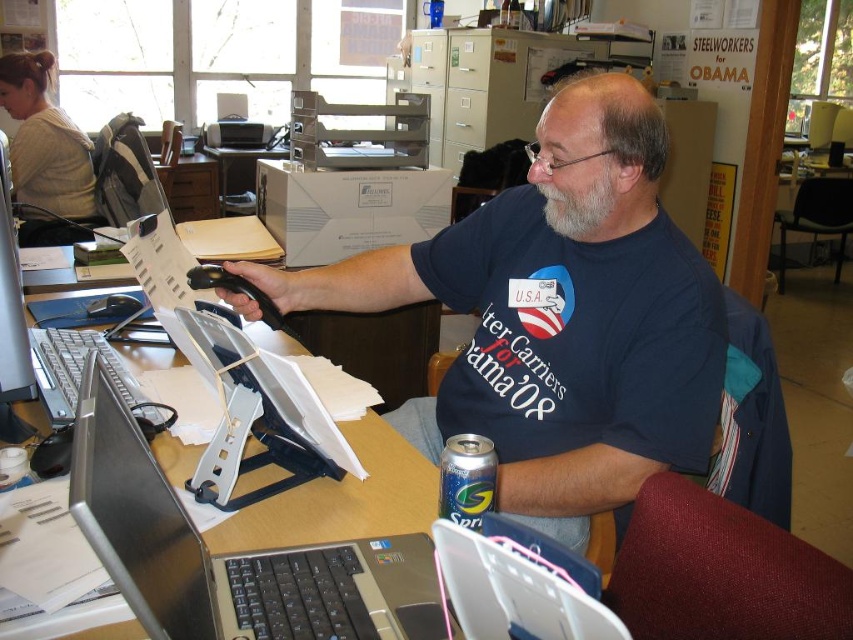
Which is in front, point (114, 429) or point (573, 196)?

Point (114, 429) is more forward.

Is silver metallic laptop at center further to camera compared to gray/soft hair at center?

No, it is not.

This screenshot has width=853, height=640. I want to click on silver metallic laptop at center, so click(x=223, y=552).

Where is `silver metallic laptop at center`? silver metallic laptop at center is located at coordinates (223, 552).

Can you confirm if matte black monitor at left is positioned to the right of gray/soft hair at center?

In fact, matte black monitor at left is to the left of gray/soft hair at center.

Can you confirm if matte black monitor at left is positioned above gray/soft hair at center?

Actually, matte black monitor at left is below gray/soft hair at center.

Describe the element at coordinates (10, 321) in the screenshot. This screenshot has width=853, height=640. I see `matte black monitor at left` at that location.

Find the location of a particular element. The width and height of the screenshot is (853, 640). matte black monitor at left is located at coordinates (10, 321).

Who is more forward, (468,492) or (613,189)?

Point (468,492) is more forward.

Which is below, blue metallic can at lower center or gray/soft hair at center?

blue metallic can at lower center

Between point (439, 467) and point (567, 209), which one is positioned behind?

The point (567, 209) is behind.

Locate an element on the screen. blue metallic can at lower center is located at coordinates (467, 480).